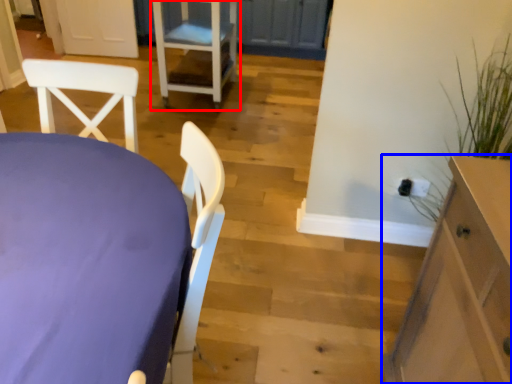
Question: Which object appears closest to the camera in this image, chair (highlighted by a red box) or cabinetry (highlighted by a blue box)?

Choices:
 (A) chair
 (B) cabinetry

Answer: (B)